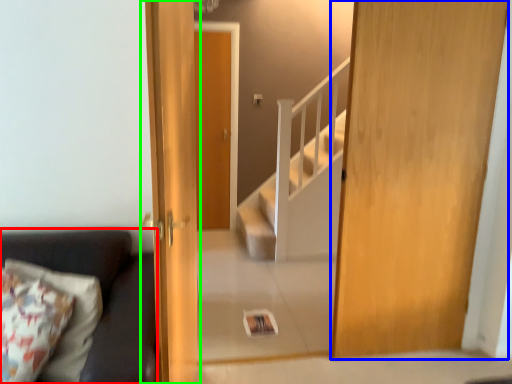
Question: Which object is the farthest from studio couch (highlighted by a red box)? Choose among these: door (highlighted by a blue box) or door (highlighted by a green box).

Choices:
 (A) door
 (B) door

Answer: (A)